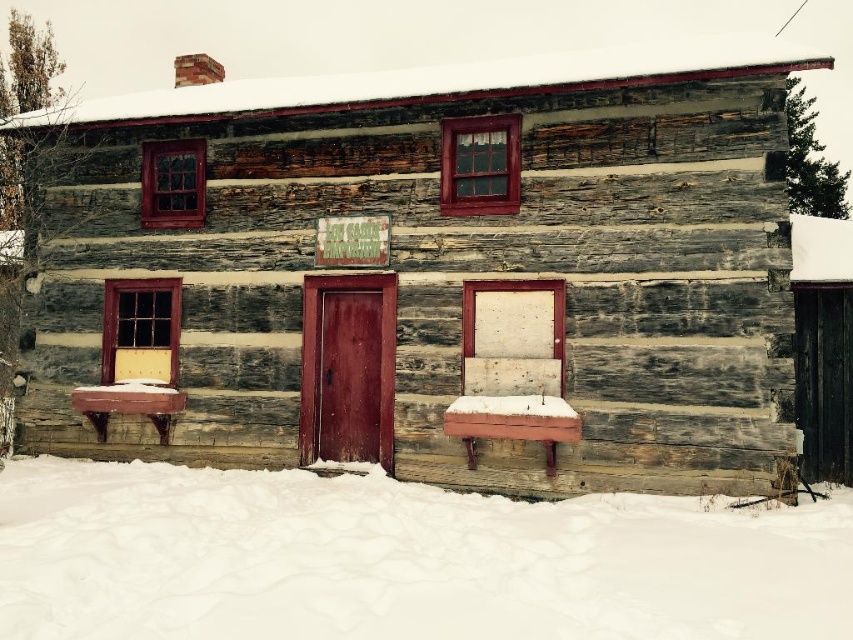
Question: Among these objects, which one is farthest from the camera?

Choices:
 (A) white fluffy snow at lower center
 (B) wooden bench at center
 (C) wooden cabin at center

Answer: (B)

Question: In this image, where is white fluffy snow at lower center located relative to wooden bench at center?

Choices:
 (A) left
 (B) right

Answer: (B)

Question: Which point is farther from the camera taking this photo?

Choices:
 (A) (469, 372)
 (B) (418, 449)
 (C) (331, 605)

Answer: (B)

Question: Can you confirm if wooden cabin at center is thinner than white fluffy snow at lower center?

Choices:
 (A) yes
 (B) no

Answer: (B)

Question: Which point appears farthest from the camera in this image?

Choices:
 (A) (329, 525)
 (B) (556, 381)

Answer: (B)

Question: Can you confirm if white fluffy snow at lower center is positioned to the right of wooden bench at center?

Choices:
 (A) no
 (B) yes

Answer: (B)